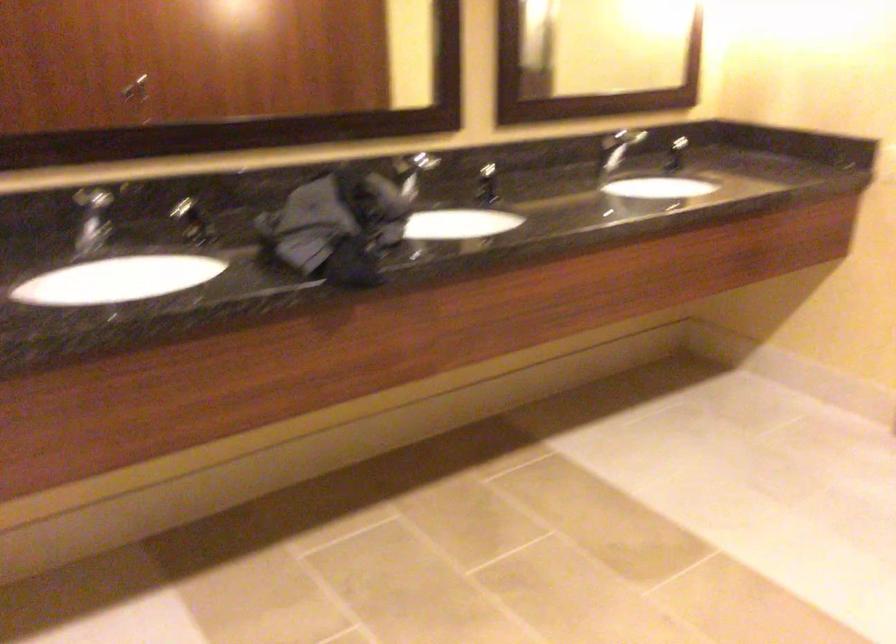
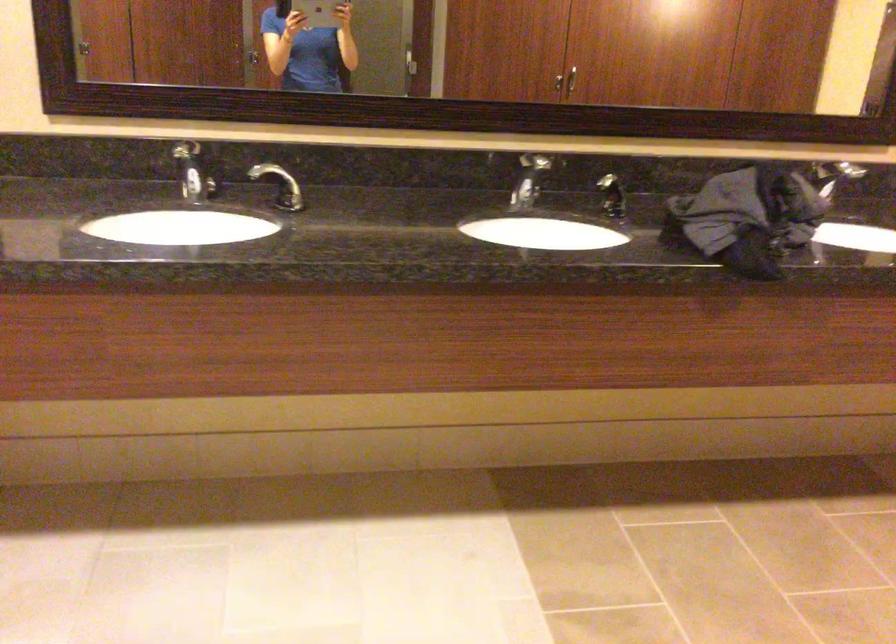
Question: The camera is either moving clockwise (left) or counter-clockwise (right) around the object. The first image is from the beginning of the video and the second image is from the end. Is the camera moving left or right when shooting the video?

Choices:
 (A) Left
 (B) Right

Answer: (B)